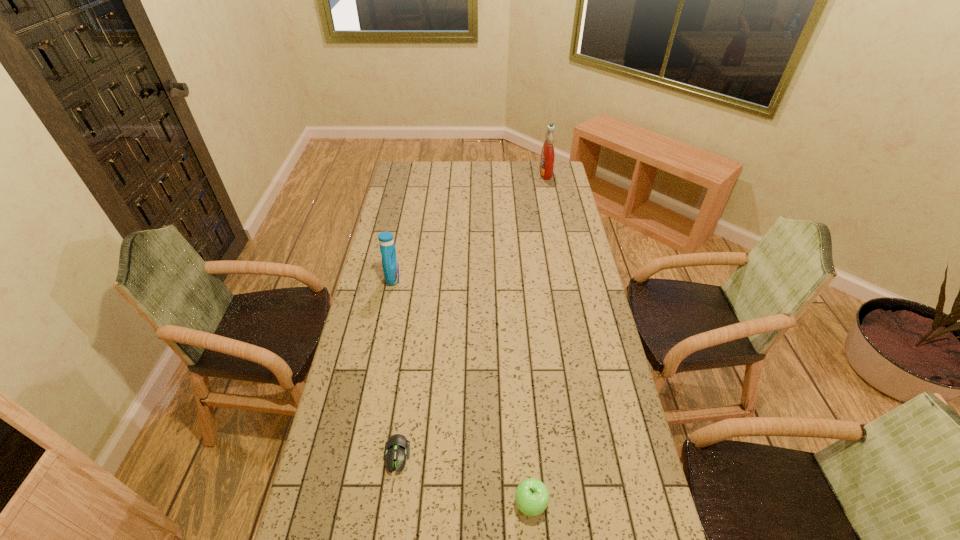
Where is `vacant space located 0.370m on the front surface of the taller detergent`? vacant space located 0.370m on the front surface of the taller detergent is located at coordinates (471, 173).

Where is `vacant space located 0.230m on the front-facing side of the shorter detergent`? vacant space located 0.230m on the front-facing side of the shorter detergent is located at coordinates coord(456,279).

Locate an element on the screen. This screenshot has width=960, height=540. vacant point located 0.170m on the left of the apple is located at coordinates (451, 503).

Locate an element on the screen. free location located on the back of the computer mouse is located at coordinates (404, 401).

Locate an element on the screen. The width and height of the screenshot is (960, 540). object at the far edge is located at coordinates (547, 155).

This screenshot has width=960, height=540. What are the coordinates of `object located in the left edge section of the desktop` in the screenshot? It's located at point(390,264).

Locate an element on the screen. object located at the right edge is located at coordinates (547, 155).

Find the location of a particular element. object that is at the far right corner is located at coordinates (547, 155).

This screenshot has height=540, width=960. Identify the location of blank space at the far edge of the desktop. (468, 179).

Where is `vacant space at the left edge of the desktop`? This screenshot has width=960, height=540. vacant space at the left edge of the desktop is located at coordinates (342, 445).